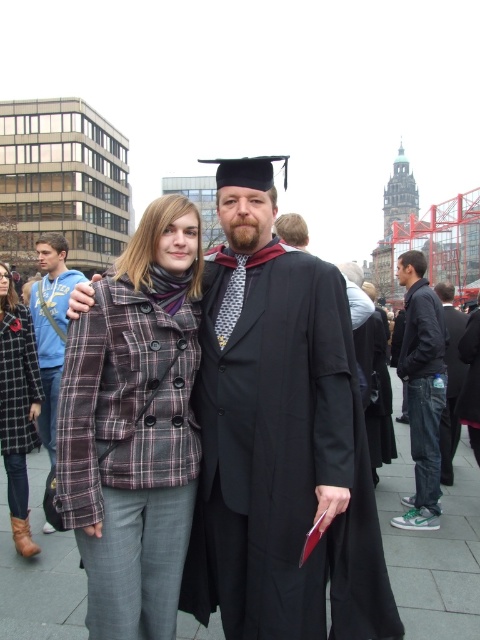
The width and height of the screenshot is (480, 640). Describe the element at coordinates (279, 436) in the screenshot. I see `plaid fabric jacket at center` at that location.

Describe the element at coordinates (279, 436) in the screenshot. I see `plaid fabric jacket at center` at that location.

Identify the location of plaid fabric jacket at center. (279, 436).

Does point (350, 490) lie in front of point (442, 388)?

Yes, point (350, 490) is closer to viewer.

Is plaid fabric jacket at center smaller than dark blue jeans at center?

No, plaid fabric jacket at center is not smaller than dark blue jeans at center.

Which is in front, point (317, 392) or point (422, 301)?

Positioned in front is point (317, 392).

Locate an element on the screen. plaid fabric jacket at center is located at coordinates (279, 436).

Which is below, plaid fabric coat at center or plaid wool coat at center?

plaid wool coat at center is below.

Which is in front, point (189, 397) or point (7, 292)?

Point (189, 397) is in front.

At what (x,y) coordinates should I click in order to perform the action: click on plaid fabric coat at center. Please return your answer as a coordinate pair (x, y). Looking at the image, I should click on (133, 426).